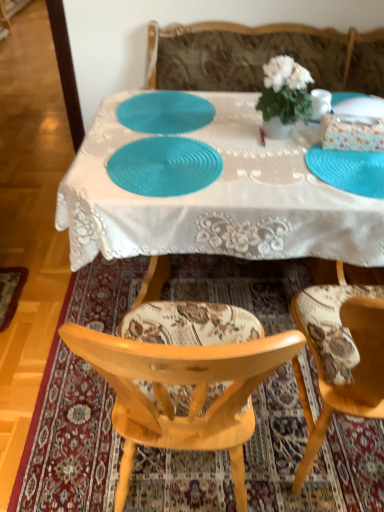
The height and width of the screenshot is (512, 384). In order to click on vacant area that is in front of blue textured placemat at center, the 1th plate positioned from the left in this screenshot , I will do `click(167, 155)`.